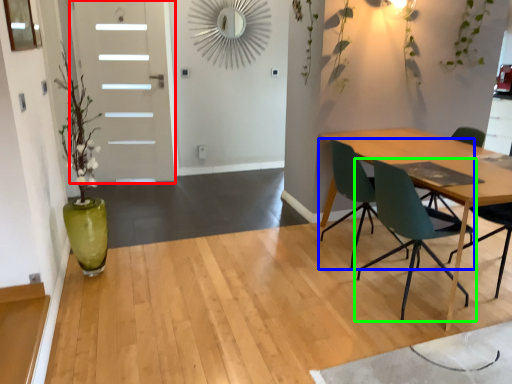
Question: Which is farther away from door (highlighted by a red box)? chair (highlighted by a blue box) or chair (highlighted by a green box)?

Choices:
 (A) chair
 (B) chair

Answer: (B)